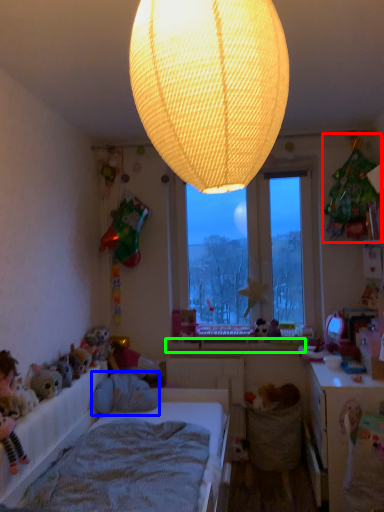
Question: Which is farther away from toy (highlighted by a red box)? animal (highlighted by a blue box) or window sill (highlighted by a green box)?

Choices:
 (A) animal
 (B) window sill

Answer: (A)